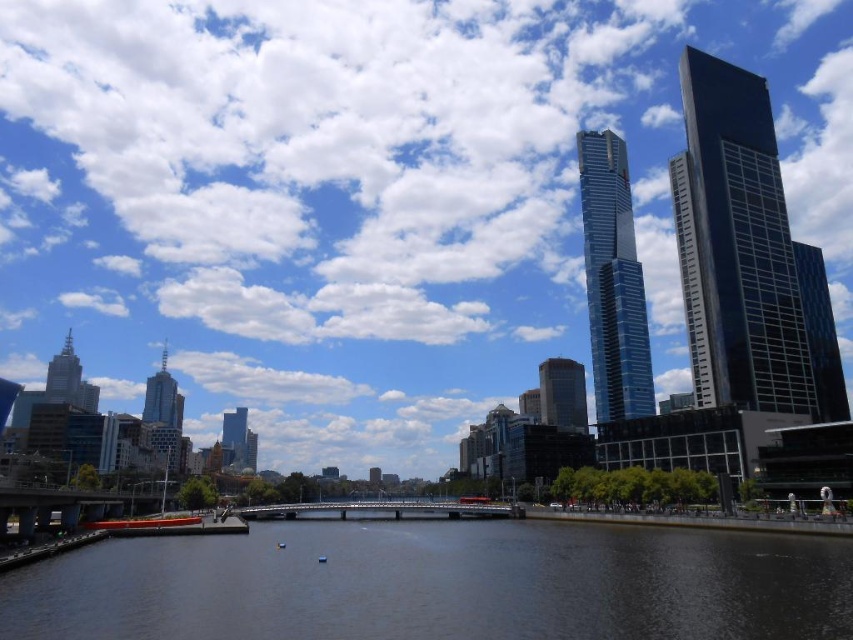
Based on the photo, you are an architect analyzing the city skyline. You notice the glassy blue skyscraper at center right and the shiny metallic skyscraper at left. Which of these two buildings has a narrower structure?

The glassy blue skyscraper at center right has a lesser width compared to the shiny metallic skyscraper at left, so it is narrower.

You are standing on the bridge and want to take a photo of the dark blue water at center and the shiny glass skyscraper at upper right. Which object will appear larger in your photo?

The dark blue water at center will appear larger in the photo because it is closer to the camera than the shiny glass skyscraper at upper right, which is further away.

You are a city planner assessing the urban layout. Considering the dark blue water at center and the shiny glass skyscraper at upper right, which one is taller?

The shiny glass skyscraper at upper right is taller than the dark blue water at center.